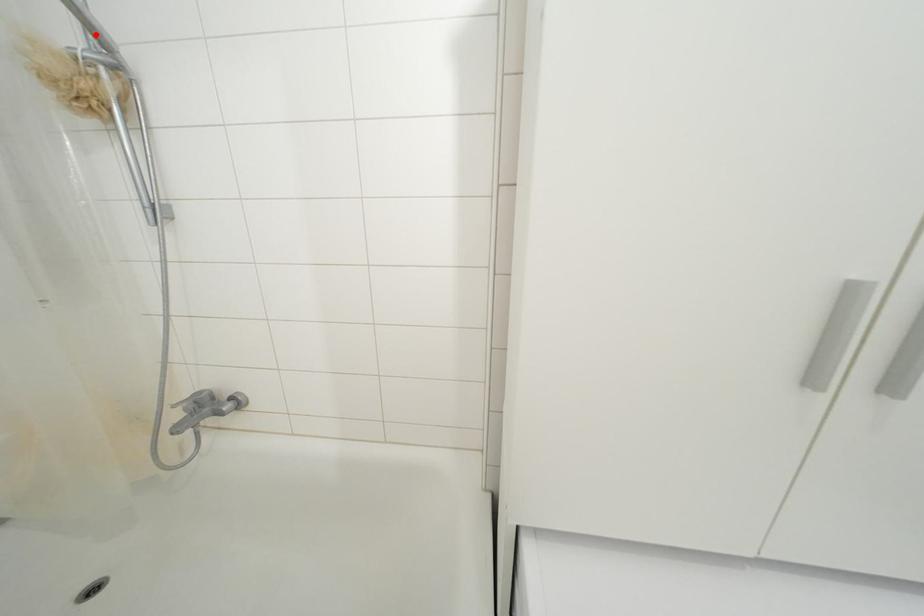
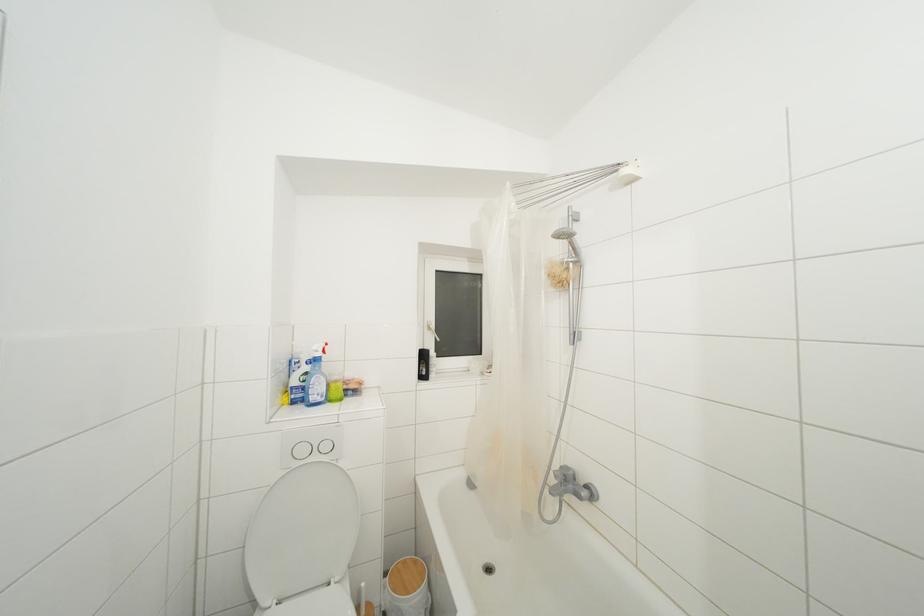
Question: I am providing you with two images of the same scene from different viewpoints. Image1 has a red point marked. In image2, the corresponding 3D location appears at what relative position? Reply with the corresponding letter.

Choices:
 (A) Closer
 (B) Farther

Answer: (A)